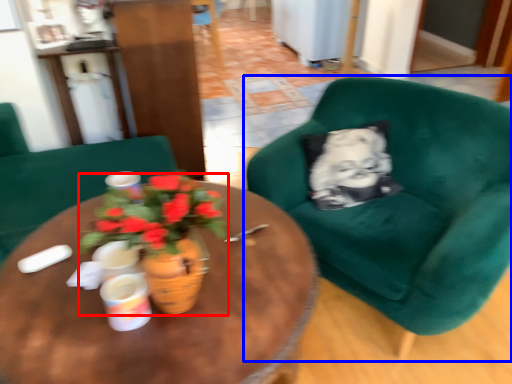
Question: Which object is closer to the camera taking this photo, houseplant (highlighted by a red box) or chair (highlighted by a blue box)?

Choices:
 (A) houseplant
 (B) chair

Answer: (A)